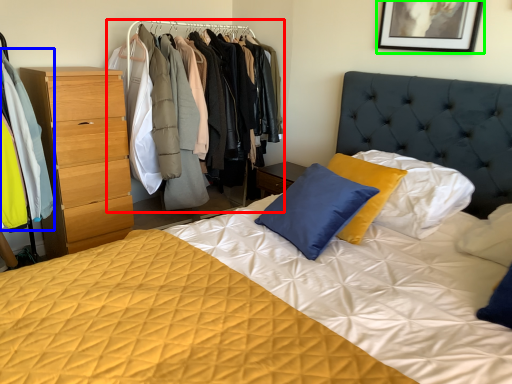
Question: Estimate the real-world distances between objects in this image. Which object is farther from dresser (highlighted by a red box), clothing (highlighted by a blue box) or picture frame (highlighted by a green box)?

Choices:
 (A) clothing
 (B) picture frame

Answer: (B)